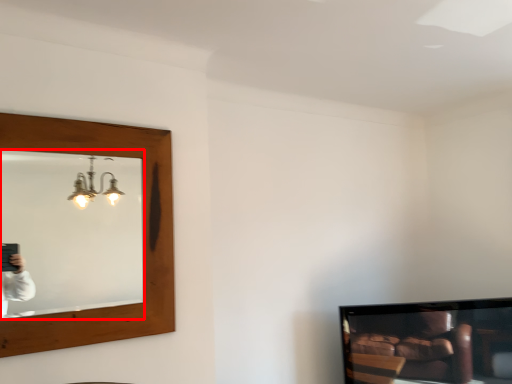
Question: In this image, where is mirror (annotated by the red box) located relative to television?

Choices:
 (A) right
 (B) left

Answer: (B)